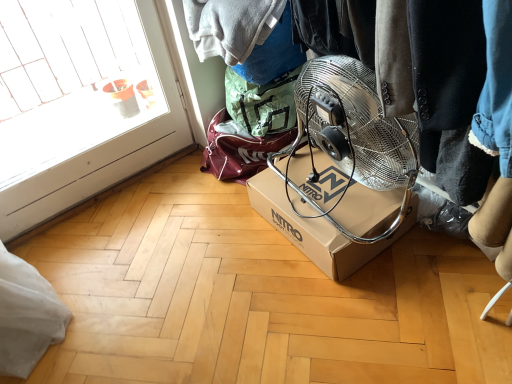
Question: Is brown cardboard box at center at the right side of transparent glass door at left?

Choices:
 (A) no
 (B) yes

Answer: (B)

Question: Is brown cardboard box at center at the left side of transparent glass door at left?

Choices:
 (A) yes
 (B) no

Answer: (B)

Question: Would you say brown cardboard box at center is a long distance from transparent glass door at left?

Choices:
 (A) yes
 (B) no

Answer: (A)

Question: From a real-world perspective, is brown cardboard box at center below transparent glass door at left?

Choices:
 (A) yes
 (B) no

Answer: (A)

Question: Is brown cardboard box at center outside of transparent glass door at left?

Choices:
 (A) yes
 (B) no

Answer: (A)

Question: Is brown cardboard box at center thinner than transparent glass door at left?

Choices:
 (A) yes
 (B) no

Answer: (B)

Question: From a real-world perspective, is transparent glass door at left on brown cardboard box at center?

Choices:
 (A) yes
 (B) no

Answer: (A)

Question: From a real-world perspective, is transparent glass door at left located beneath brown cardboard box at center?

Choices:
 (A) yes
 (B) no

Answer: (B)

Question: Is the surface of transparent glass door at left in direct contact with brown cardboard box at center?

Choices:
 (A) yes
 (B) no

Answer: (B)

Question: Can you confirm if transparent glass door at left is wider than brown cardboard box at center?

Choices:
 (A) yes
 (B) no

Answer: (B)

Question: From the image's perspective, is transparent glass door at left beneath brown cardboard box at center?

Choices:
 (A) yes
 (B) no

Answer: (B)

Question: Does transparent glass door at left have a greater height compared to brown cardboard box at center?

Choices:
 (A) yes
 (B) no

Answer: (A)

Question: Looking at their shapes, would you say brown cardboard box at center is wider or thinner than transparent glass door at left?

Choices:
 (A) wide
 (B) thin

Answer: (A)